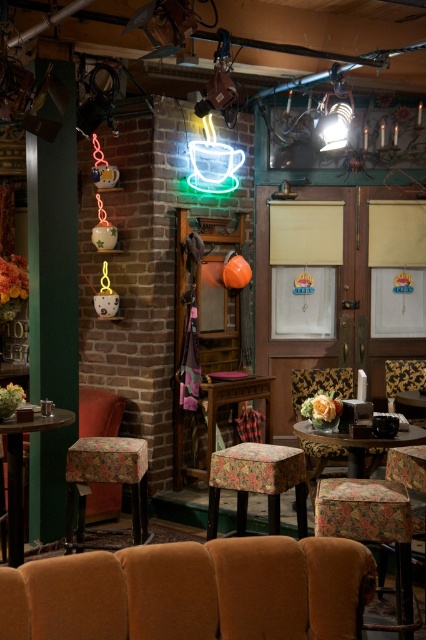
Is velvet-patterned armchair at center bigger than wooden table at center?

Correct, velvet-patterned armchair at center is larger in size than wooden table at center.

Consider the image. Does velvet-patterned armchair at center appear on the left side of wooden table at center?

Correct, you'll find velvet-patterned armchair at center to the left of wooden table at center.

Is point (408, 374) closer to camera compared to point (420, 413)?

Yes, it is in front of point (420, 413).

Find the location of `velvet-patterned armchair at center`. velvet-patterned armchair at center is located at coordinates (x=402, y=378).

Is velvet orange armchair at lower center smaller than velvet-patterned armchair at center?

No.

In the scene shown: Can you confirm if velvet orange armchair at lower center is positioned below velvet-patterned armchair at center?

Yes.

Locate an element on the screen. velvet orange armchair at lower center is located at coordinates pos(190,592).

The width and height of the screenshot is (426, 640). What are the coordinates of `velvet orange armchair at lower center` in the screenshot? It's located at (190, 592).

From the picture: Can you confirm if neon green glass coffee cup at upper center is taller than floral fabric ottoman at center?

In fact, neon green glass coffee cup at upper center may be shorter than floral fabric ottoman at center.

Who is more distant from viewer, (221,189) or (267,426)?

The point (221,189) is more distant.

This screenshot has height=640, width=426. I want to click on neon green glass coffee cup at upper center, so click(x=213, y=163).